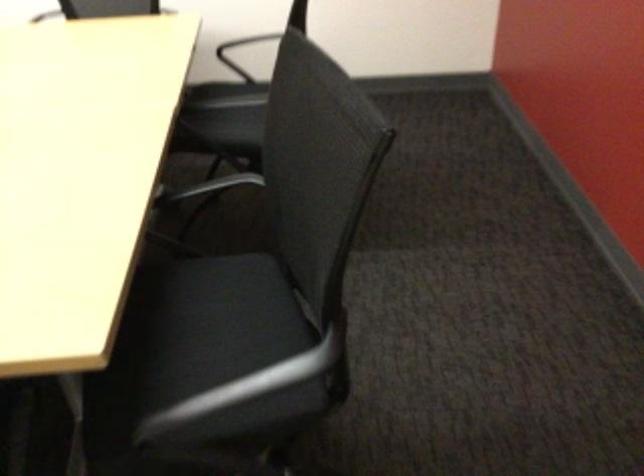
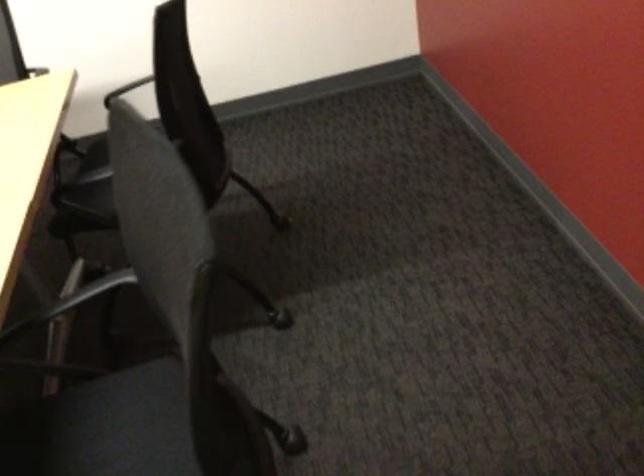
Looking at this image, the images are taken continuously from a first-person perspective. In which direction are you moving?

The cameraman moved toward right, forward.